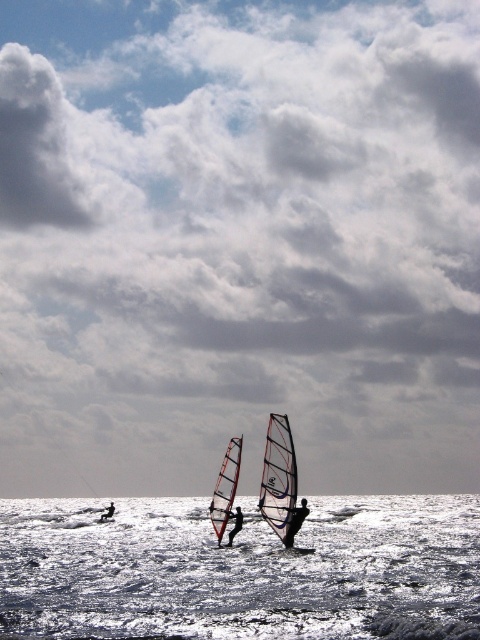
Can you confirm if white frothy water at center is wider than dark blue fabric sail at center?

Yes, white frothy water at center is wider than dark blue fabric sail at center.

Consider the image. Who is lower down, white frothy water at center or dark blue fabric sail at center?

white frothy water at center is below.

Measure the distance between white frothy water at center and camera.

white frothy water at center and camera are 18.37 meters apart from each other.

This screenshot has width=480, height=640. Find the location of `white frothy water at center`. white frothy water at center is located at coordinates (241, 570).

Does clear plastic sail at center appear on the right side of transparent white sail at center?

Correct, you'll find clear plastic sail at center to the right of transparent white sail at center.

Who is more distant from viewer, (269, 420) or (225, 474)?

The point (225, 474) is more distant.

Image resolution: width=480 pixels, height=640 pixels. Describe the element at coordinates (279, 481) in the screenshot. I see `clear plastic sail at center` at that location.

The height and width of the screenshot is (640, 480). Find the location of `clear plastic sail at center`. clear plastic sail at center is located at coordinates (279, 481).

Can you confirm if white frothy water at center is wider than transparent white sail at center?

Correct, the width of white frothy water at center exceeds that of transparent white sail at center.

Can you confirm if white frothy water at center is smaller than transparent white sail at center?

Incorrect, white frothy water at center is not smaller in size than transparent white sail at center.

Is point (468, 570) less distant than point (214, 515)?

Yes, point (468, 570) is in front of point (214, 515).

Locate an element on the screen. This screenshot has height=640, width=480. white frothy water at center is located at coordinates coord(241,570).